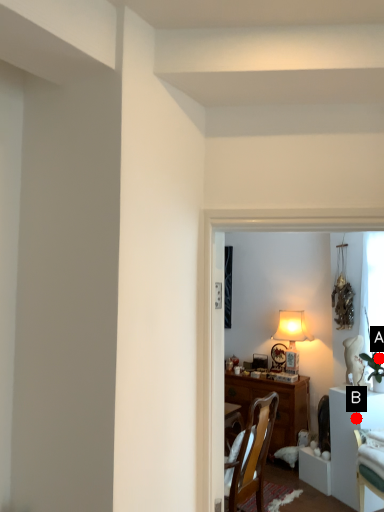
Question: Two points are circled on the image, labeled by A and B beside each circle. Which point is farther from the camera taking this photo?

Choices:
 (A) A is further
 (B) B is further

Answer: (A)